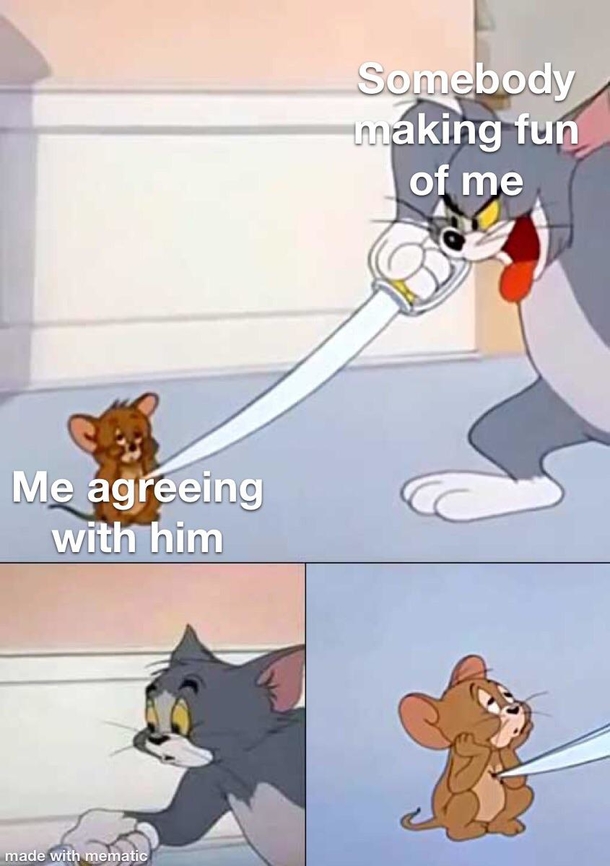
I want to click on walls, so pos(171,72), pos(124,279), pos(72,643), pos(52,708).